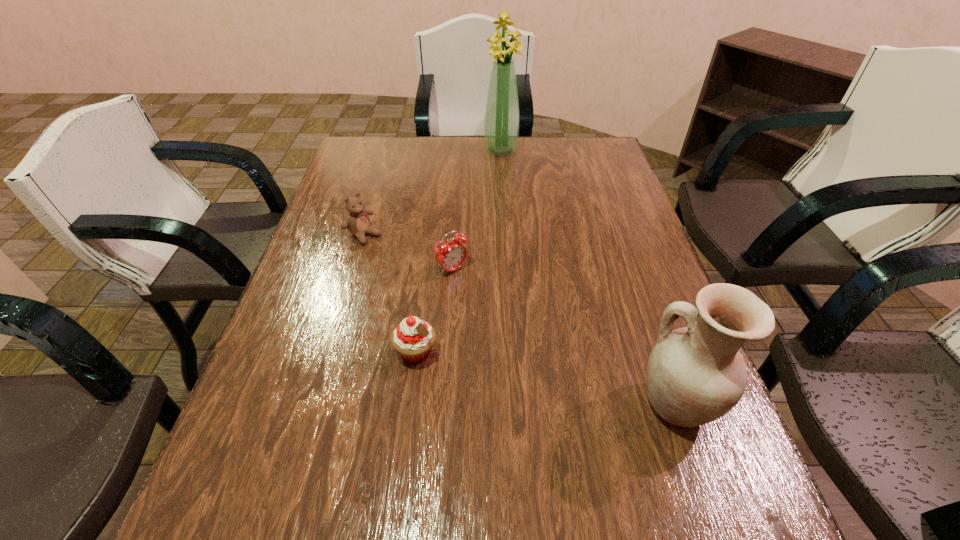
I want to click on free spot on the desktop that is between the cupcake and the rightmost object and is positioned on the front-facing side of the second object from right to left, so click(x=529, y=375).

Locate an element on the screen. The height and width of the screenshot is (540, 960). free space on the desktop that is between the cupcake and the rightmost object and is positioned on the front-facing side of the second farthest object is located at coordinates pos(555,380).

Where is `vacant space on the desktop that is between the cupcake and the fourth shortest object and is positioned on the face of the alarm clock`? vacant space on the desktop that is between the cupcake and the fourth shortest object and is positioned on the face of the alarm clock is located at coordinates (570, 383).